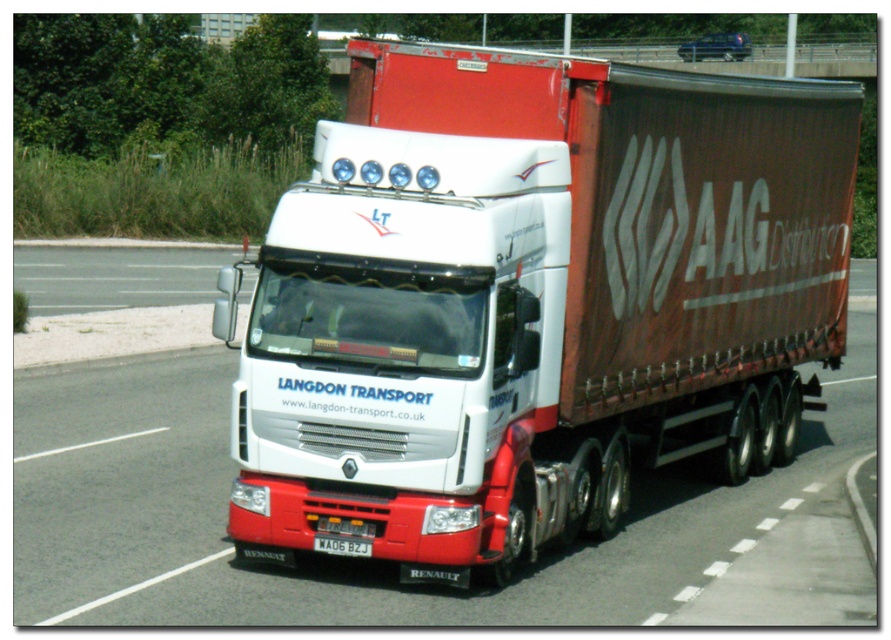
Question: Which of the following is the farthest from the observer?

Choices:
 (A) (346, 548)
 (B) (255, 432)

Answer: (B)

Question: Is white matte truck at center to the left of red plastic license plate at bottom center from the viewer's perspective?

Choices:
 (A) yes
 (B) no

Answer: (B)

Question: Which point appears closest to the camera in this image?

Choices:
 (A) tap(631, 484)
 (B) tap(397, 83)
 (C) tap(366, 545)

Answer: (C)

Question: Is the position of white glossy truck at center less distant than that of red plastic license plate at bottom center?

Choices:
 (A) no
 (B) yes

Answer: (B)

Question: Does white matte truck at center have a smaller size compared to white glossy truck at center?

Choices:
 (A) yes
 (B) no

Answer: (A)

Question: Which of these objects is positioned farthest from the white matte truck at center?

Choices:
 (A) red plastic license plate at bottom center
 (B) white glossy truck at center

Answer: (B)